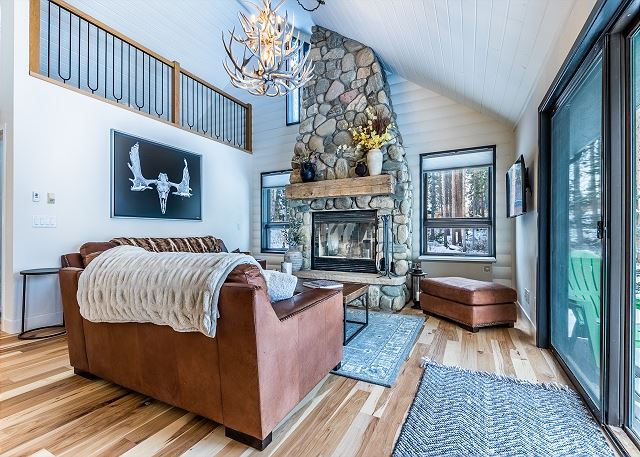
Identify the location of stone chimney. (329, 63), (355, 73), (324, 135), (339, 146), (397, 239), (300, 236).